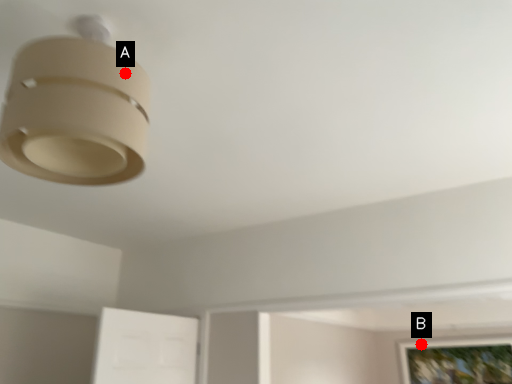
Question: Two points are circled on the image, labeled by A and B beside each circle. Which point is closer to the camera taking this photo?

Choices:
 (A) A is closer
 (B) B is closer

Answer: (A)